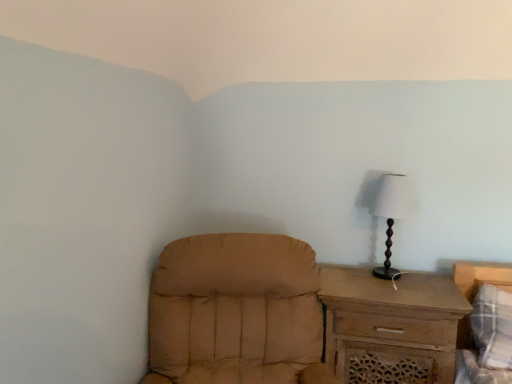
Identify the location of vacant space to the left of white fabric lampshade at right. (351, 281).